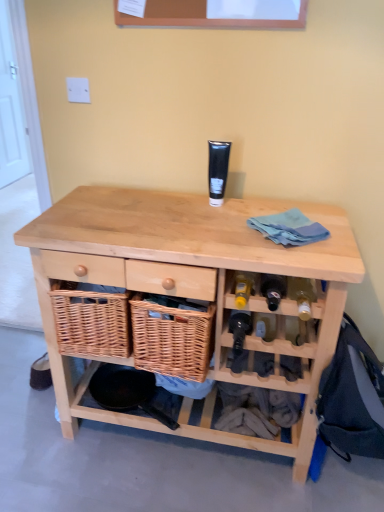
Identify the location of natural wood table at center. This screenshot has width=384, height=512. (192, 287).

Image resolution: width=384 pixels, height=512 pixels. What do you see at coordinates (192, 287) in the screenshot? I see `natural wood table at center` at bounding box center [192, 287].

What do you see at coordinates (239, 329) in the screenshot? This screenshot has width=384, height=512. I see `shiny dark glass wine bottle at center, positioned as the first wine bottle in bottom-to-top order` at bounding box center [239, 329].

You are a GUI agent. You are given a task and a screenshot of the screen. Output one action in this format:
    pyautogui.click(x=<x>, y=<y>)
    Task: Click on the white painted wood door at left
    This screenshot has width=384, height=512.
    Given the screenshot: What is the action you would take?
    pyautogui.click(x=11, y=109)

You are a GUI agent. You are given a task and a screenshot of the screen. Output one action in this format:
    pyautogui.click(x=<x>, y=<y>)
    Task: Click on the translucent glass wine bottle at lower right, the 1th wine bottle viewed from the right
    This screenshot has height=512, width=384.
    Given the screenshot: What is the action you would take?
    pyautogui.click(x=302, y=295)

Considering the relative positions of black matte tube at center and translucent glass wine bottle at lower right, the first wine bottle from the top, in the image provided, is black matte tube at center in front of translucent glass wine bottle at lower right, the first wine bottle from the top,?

No.

Which object is positioned more to the right, black matte tube at center or translucent glass wine bottle at lower right, the 1th wine bottle viewed from the right?

Positioned to the right is translucent glass wine bottle at lower right, the 1th wine bottle viewed from the right.

Is black matte tube at center facing away from translucent glass wine bottle at lower right, which appears as the second wine bottle when viewed from the left?

No, translucent glass wine bottle at lower right, which appears as the second wine bottle when viewed from the left, is not at the back of black matte tube at center.

Which wine bottle is the 2nd one when counting from the right side of the black matte tube at center? Please provide its 2D coordinates.

[(302, 295)]

Which is correct: white painted wood door at left is inside shiny dark glass wine bottle at center, positioned as the first wine bottle in bottom-to-top order, or outside of it?

white painted wood door at left is not inside shiny dark glass wine bottle at center, positioned as the first wine bottle in bottom-to-top order, it's outside.

Is white painted wood door at left far from shiny dark glass wine bottle at center, positioned as the first wine bottle in bottom-to-top order?

Indeed, white painted wood door at left is not near shiny dark glass wine bottle at center, positioned as the first wine bottle in bottom-to-top order.

Which object is wider, white painted wood door at left or shiny dark glass wine bottle at center, positioned as the first wine bottle in bottom-to-top order?

shiny dark glass wine bottle at center, positioned as the first wine bottle in bottom-to-top order.

Is natural wood table at center with translucent glass wine bottle at lower right, the 1th wine bottle viewed from the right?

No.

Who is shorter, natural wood table at center or translucent glass wine bottle at lower right, which appears as the second wine bottle when viewed from the left?

translucent glass wine bottle at lower right, which appears as the second wine bottle when viewed from the left, is shorter.

At what (x,y) coordinates should I click in order to perform the action: click on table located on the left of translucent glass wine bottle at lower right, arranged as the second wine bottle when ordered from the bottom. Please return your answer as a coordinate pair (x, y). Looking at the image, I should click on (192, 287).

From a real-world perspective, which is physically above, shiny dark glass wine bottle at center, positioned as the first wine bottle in bottom-to-top order, or black matte tube at center?

black matte tube at center is physically above.

Is shiny dark glass wine bottle at center, positioned as the first wine bottle in bottom-to-top order, positioned with its back to black matte tube at center?

No.

Does point (242, 348) come in front of point (212, 163)?

Yes, it is in front of point (212, 163).

From a real-world perspective, is translucent glass wine bottle at lower right, the 1th wine bottle viewed from the right, beneath white painted wood door at left?

Yes, from a real-world perspective, translucent glass wine bottle at lower right, the 1th wine bottle viewed from the right, is beneath white painted wood door at left.

Considering the sizes of translucent glass wine bottle at lower right, the first wine bottle from the top, and white painted wood door at left in the image, is translucent glass wine bottle at lower right, the first wine bottle from the top, taller or shorter than white painted wood door at left?

Considering their sizes, translucent glass wine bottle at lower right, the first wine bottle from the top, has less height than white painted wood door at left.

Is translucent glass wine bottle at lower right, the 1th wine bottle viewed from the right, at the left side of white painted wood door at left?

No.

From a real-world perspective, is white painted wood door at left physically below black matte tube at center?

Correct, in the physical world, white painted wood door at left is lower than black matte tube at center.

Is white painted wood door at left closer to the viewer compared to black matte tube at center?

No.

Does point (9, 128) come closer to viewer compared to point (210, 147)?

No, it is not.

Which object is positioned more to the left, white painted wood door at left or black matte tube at center?

From the viewer's perspective, white painted wood door at left appears more on the left side.

Can white painted wood door at left be found inside shiny dark glass wine bottle at center, which appears as the second wine bottle when viewed from the right?

No.

Who is more distant, shiny dark glass wine bottle at center, placed as the 1th wine bottle when sorted from left to right, or white painted wood door at left?

Positioned behind is white painted wood door at left.

Find the location of a particular element. The image size is (384, 512). door that is behind the shiny dark glass wine bottle at center, which appears as the second wine bottle when viewed from the right is located at coordinates (11, 109).

Is point (242, 348) closer to viewer compared to point (19, 94)?

Yes, point (242, 348) is closer to viewer.

Find the location of `the 1st wine bottle positioned below the black matte tube at center (from a real-world perspective)`. the 1st wine bottle positioned below the black matte tube at center (from a real-world perspective) is located at coordinates (302, 295).

Locate an element on the screen. The height and width of the screenshot is (512, 384). the 1st wine bottle to the right of the white painted wood door at left, counting from the anchor's position is located at coordinates (239, 329).

Considering their positions, is natural wood table at center positioned closer to translucent glass wine bottle at lower right, the 1th wine bottle viewed from the right, than white painted wood door at left?

natural wood table at center is closer to translucent glass wine bottle at lower right, the 1th wine bottle viewed from the right.

Considering their positions, is black matte tube at center positioned closer to shiny dark glass wine bottle at center, placed as the 1th wine bottle when sorted from left to right, than white painted wood door at left?

black matte tube at center.

Which object lies further to the anchor point natural wood table at center, shiny dark glass wine bottle at center, positioned as the first wine bottle in bottom-to-top order, or black matte tube at center?

black matte tube at center is positioned further to the anchor natural wood table at center.

Considering their positions, is white painted wood door at left positioned further to shiny dark glass wine bottle at center, positioned as the first wine bottle in bottom-to-top order, than translucent glass wine bottle at lower right, which appears as the second wine bottle when viewed from the left?

The object further to shiny dark glass wine bottle at center, positioned as the first wine bottle in bottom-to-top order, is white painted wood door at left.

Based on their spatial positions, is translucent glass wine bottle at lower right, the 1th wine bottle viewed from the right, or white painted wood door at left further from natural wood table at center?

Among the two, white painted wood door at left is located further to natural wood table at center.

Estimate the real-world distances between objects in this image. Which object is closer to white painted wood door at left, shiny dark glass wine bottle at center, the second wine bottle viewed from the top, or natural wood table at center?

natural wood table at center lies closer to white painted wood door at left than the other object.

Looking at this image, which object lies further to the anchor point translucent glass wine bottle at lower right, the first wine bottle from the top, white painted wood door at left or black matte tube at center?

Among the two, white painted wood door at left is located further to translucent glass wine bottle at lower right, the first wine bottle from the top.

When comparing their distances from translucent glass wine bottle at lower right, arranged as the second wine bottle when ordered from the bottom, does shiny dark glass wine bottle at center, which appears as the second wine bottle when viewed from the right, or black matte tube at center seem further?

black matte tube at center lies further to translucent glass wine bottle at lower right, arranged as the second wine bottle when ordered from the bottom, than the other object.

Locate an element on the screen. wine bottle located between translucent glass wine bottle at lower right, the 1th wine bottle viewed from the right, and white painted wood door at left in the depth direction is located at coordinates (239, 329).

In order to click on toiletry between natural wood table at center and white painted wood door at left from front to back in this screenshot , I will do `click(218, 170)`.

The image size is (384, 512). I want to click on wine bottle situated between natural wood table at center and translucent glass wine bottle at lower right, arranged as the second wine bottle when ordered from the bottom, from left to right, so click(239, 329).

The height and width of the screenshot is (512, 384). I want to click on wine bottle between black matte tube at center and shiny dark glass wine bottle at center, placed as the 1th wine bottle when sorted from left to right, in the up-down direction, so click(302, 295).